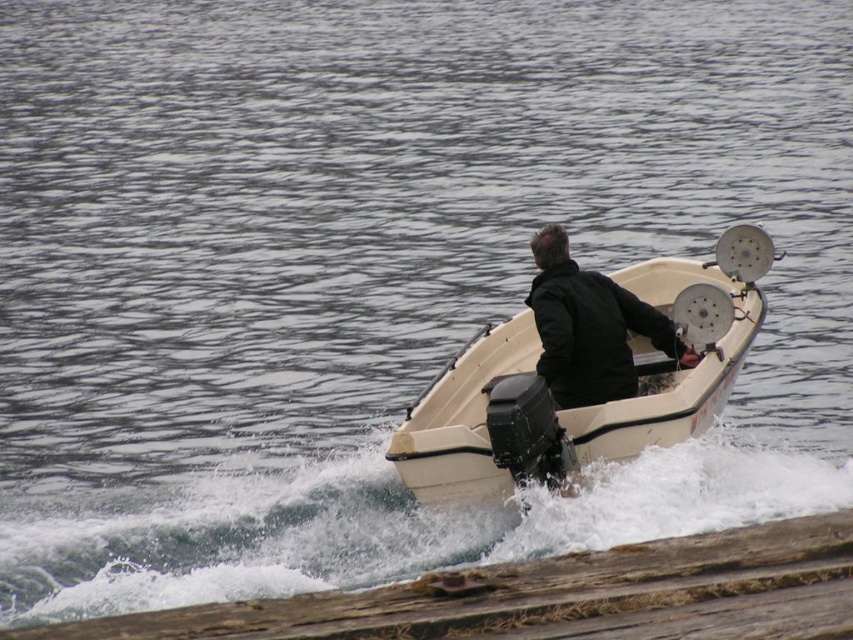
Between white plastic boat at center and wooden log at lower center, which one is positioned higher?

white plastic boat at center

Looking at this image, does white plastic boat at center have a greater height compared to wooden log at lower center?

Correct, white plastic boat at center is much taller as wooden log at lower center.

Locate an element on the screen. The width and height of the screenshot is (853, 640). white plastic boat at center is located at coordinates (590, 364).

Can you confirm if white plastic boat at center is positioned to the right of black matte jacket at center?

In fact, white plastic boat at center is to the left of black matte jacket at center.

Who is positioned more to the left, white plastic boat at center or black matte jacket at center?

From the viewer's perspective, white plastic boat at center appears more on the left side.

Which is behind, point (566, 328) or point (611, 348)?

The point (611, 348) is behind.

Find the location of a particular element. white plastic boat at center is located at coordinates (590, 364).

Can you confirm if wooden log at lower center is wider than black matte jacket at center?

Correct, the width of wooden log at lower center exceeds that of black matte jacket at center.

Which is in front, point (767, 561) or point (619, 332)?

Point (767, 561) is in front.

Find the location of a particular element. The height and width of the screenshot is (640, 853). wooden log at lower center is located at coordinates (556, 596).